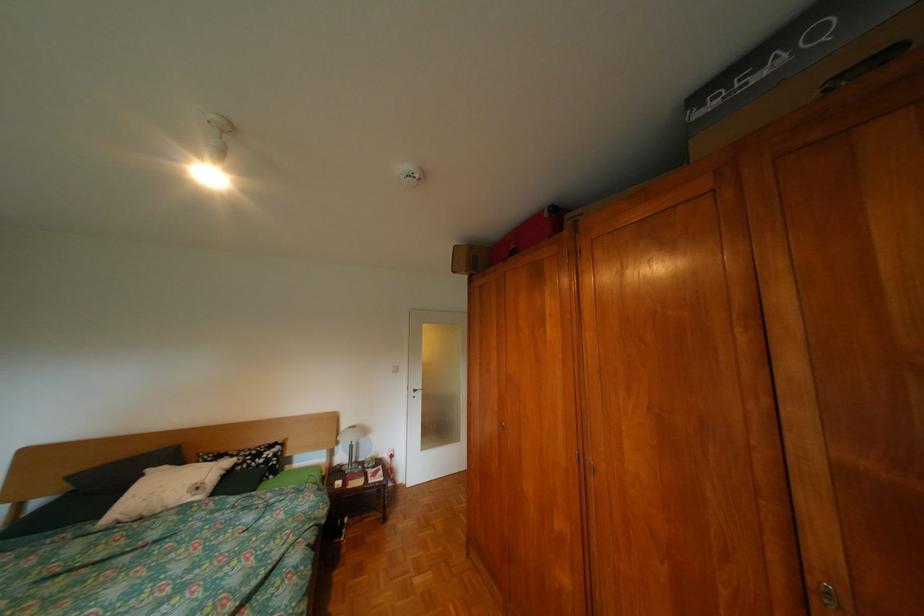
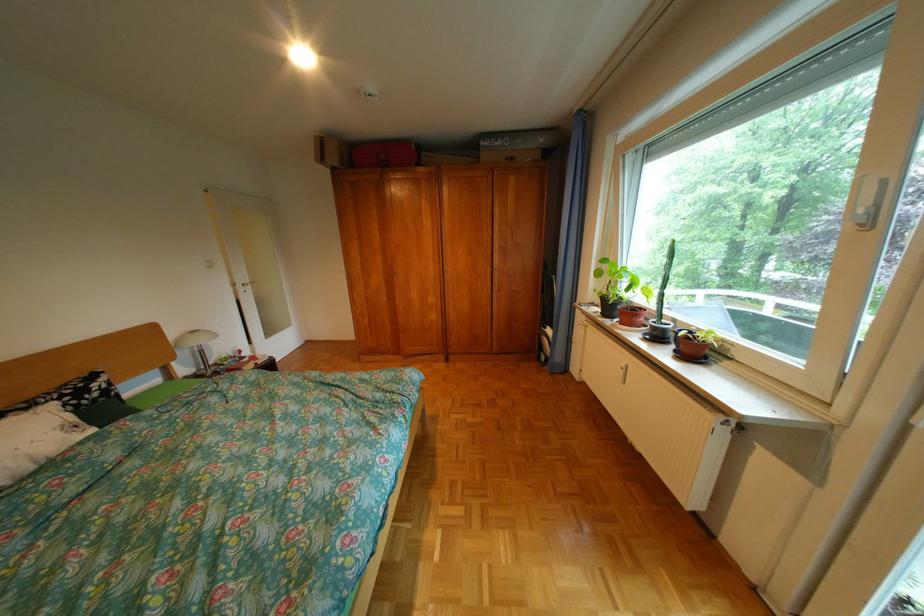
The point at (505, 424) is marked in the first image. Where is the corresponding point in the second image?

(392, 280)